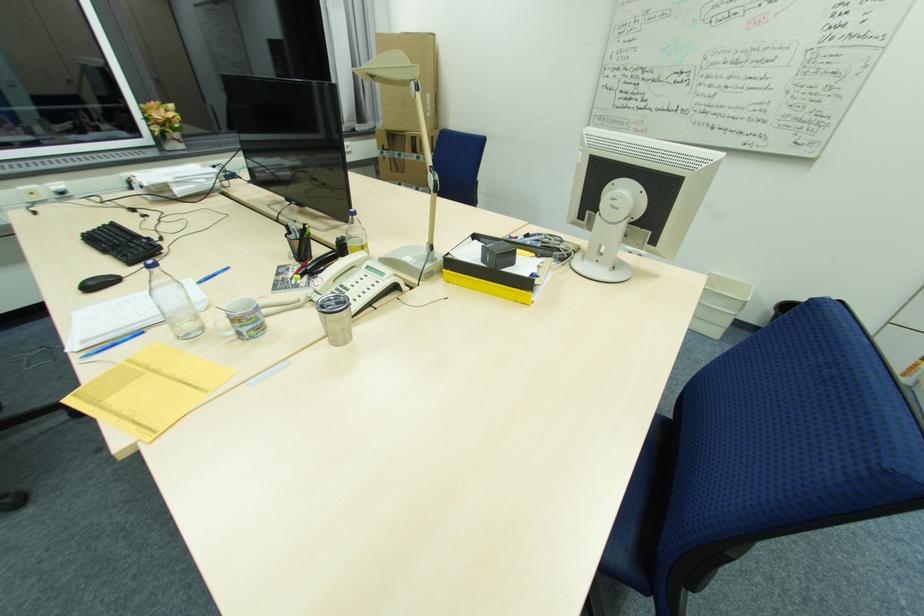
This screenshot has height=616, width=924. What do you see at coordinates (497, 254) in the screenshot? I see `a small black box` at bounding box center [497, 254].